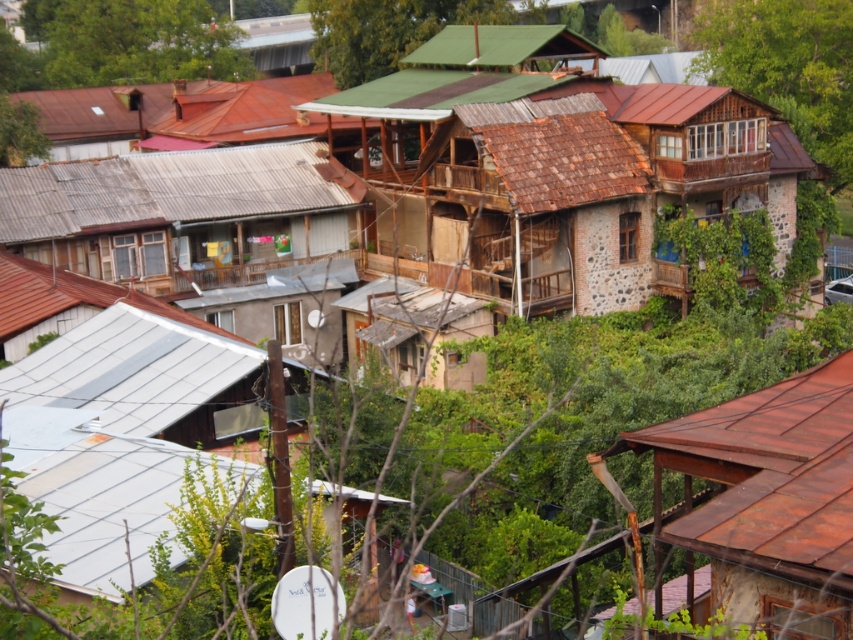
Question: Which is nearer to the gray corrugated metal roof at center-left?

Choices:
 (A) green wood tree at upper right
 (B) green matte roof at upper center
 (C) green leafy tree at upper center

Answer: (B)

Question: Is rusty metal roof at center above green leafy tree at upper center?

Choices:
 (A) no
 (B) yes

Answer: (A)

Question: Considering the real-world distances, which object is closest to the gray corrugated metal roof at center-left?

Choices:
 (A) rusty wood house at center
 (B) green leafy tree at upper center
 (C) green matte roof at upper center

Answer: (A)

Question: Among these objects, which one is nearest to the camera?

Choices:
 (A) green matte roof at upper center
 (B) rusty metal roof at center

Answer: (B)

Question: Considering the relative positions of rusty wood house at center and green leafy tree at upper center in the image provided, where is rusty wood house at center located with respect to green leafy tree at upper center?

Choices:
 (A) above
 (B) below

Answer: (B)

Question: Does gray corrugated metal roof at center-left have a greater width compared to green leafy tree at upper center?

Choices:
 (A) yes
 (B) no

Answer: (B)